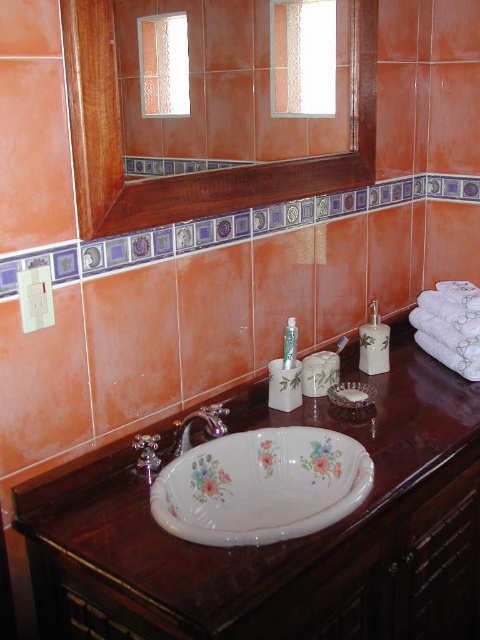
You are a delivery person who needs to place a new 0.5 meters wide decorative vase between the porcelain floral sink at center and the decorative border on the wall. Is there enough space between them to fit the vase?

The porcelain floral sink at center and the decorative border on the wall are 1.00 meters apart. Since the vase is only 0.5 meters wide, there is sufficient space to place it between them.

You are standing in the bathroom and want to turn on the water. Which object, the brown polished wood counter top at center or the silver metallic faucet at center, should you interact with first to access the water flow?

The silver metallic faucet at center is the correct object to interact with to access the water flow. The brown polished wood counter top at center is merely the surface on which the faucet is mounted and does not control the water flow itself.

You are designing a bathroom layout and need to place a decorative vase between the porcelain floral sink at center and the silver metallic faucet at center. Considering their sizes, which object should the vase be closer to?

The porcelain floral sink at center is larger than the silver metallic faucet at center, so the vase should be placed closer to the porcelain floral sink at center to maintain balance.